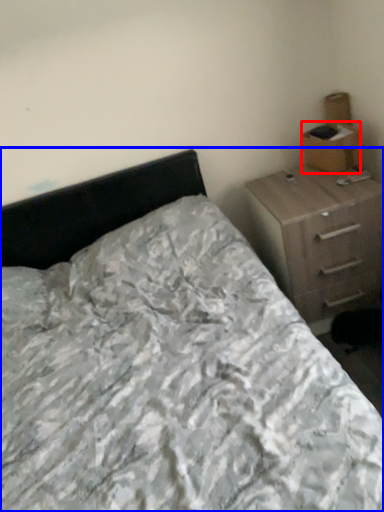
Question: Which object is further to the camera taking this photo, cardboard box (highlighted by a red box) or bed (highlighted by a blue box)?

Choices:
 (A) cardboard box
 (B) bed

Answer: (A)